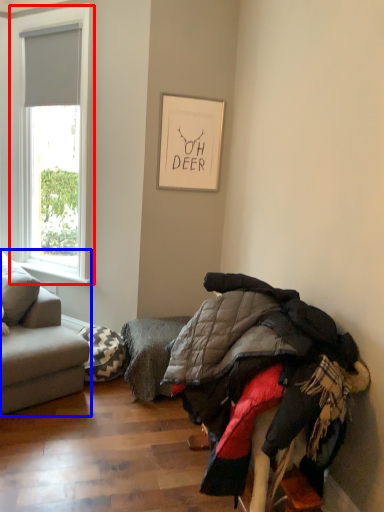
Question: Which object is closer to the camera taking this photo, window (highlighted by a red box) or studio couch (highlighted by a blue box)?

Choices:
 (A) window
 (B) studio couch

Answer: (B)